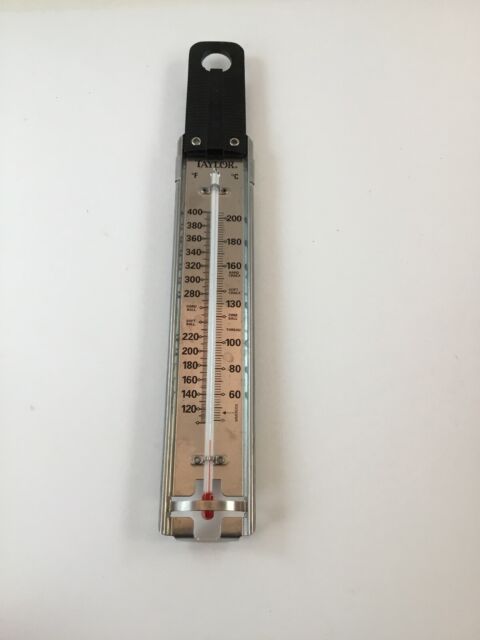
Image resolution: width=480 pixels, height=640 pixels. Find the location of `hook`. hook is located at coordinates (222, 61).